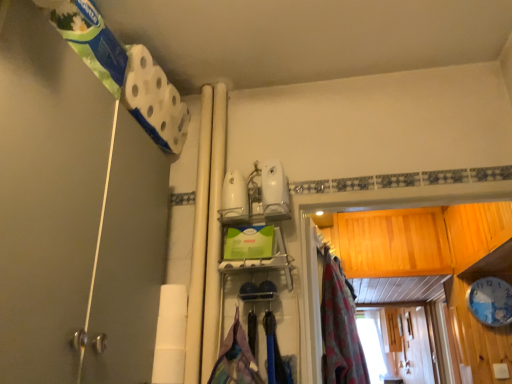
Question: Should I look upward or downward to see textured fabric laundry at center?

Choices:
 (A) up
 (B) down

Answer: (B)

Question: Considering the relative positions of white matte shower door at left and white matte toilet paper at lower left in the image provided, is white matte shower door at left to the left of white matte toilet paper at lower left from the viewer's perspective?

Choices:
 (A) yes
 (B) no

Answer: (A)

Question: Is white matte shower door at left far from white matte toilet paper at lower left?

Choices:
 (A) no
 (B) yes

Answer: (A)

Question: From a real-world perspective, does white matte shower door at left stand above white matte toilet paper at lower left?

Choices:
 (A) yes
 (B) no

Answer: (A)

Question: Can you confirm if white matte shower door at left is wider than white matte toilet paper at lower left?

Choices:
 (A) yes
 (B) no

Answer: (A)

Question: Considering the relative sizes of white matte shower door at left and white matte toilet paper at lower left in the image provided, is white matte shower door at left bigger than white matte toilet paper at lower left?

Choices:
 (A) no
 (B) yes

Answer: (B)

Question: Does white matte shower door at left come in front of white matte toilet paper at lower left?

Choices:
 (A) no
 (B) yes

Answer: (B)

Question: Can we say textured fabric laundry at center lies outside floral fabric curtain at center?

Choices:
 (A) yes
 (B) no

Answer: (A)

Question: From a real-world perspective, is textured fabric laundry at center positioned under floral fabric curtain at center based on gravity?

Choices:
 (A) yes
 (B) no

Answer: (A)

Question: Considering the relative sizes of textured fabric laundry at center and floral fabric curtain at center in the image provided, is textured fabric laundry at center thinner than floral fabric curtain at center?

Choices:
 (A) yes
 (B) no

Answer: (A)

Question: Considering the relative sizes of textured fabric laundry at center and floral fabric curtain at center in the image provided, is textured fabric laundry at center wider than floral fabric curtain at center?

Choices:
 (A) yes
 (B) no

Answer: (B)

Question: Does textured fabric laundry at center have a greater height compared to floral fabric curtain at center?

Choices:
 (A) yes
 (B) no

Answer: (B)

Question: Can you confirm if textured fabric laundry at center is bigger than floral fabric curtain at center?

Choices:
 (A) no
 (B) yes

Answer: (A)

Question: Is white matte shower door at left wider than floral fabric curtain at center?

Choices:
 (A) no
 (B) yes

Answer: (B)